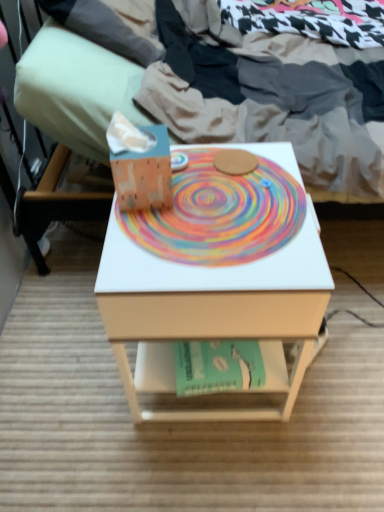
Where is `vacant point above teal paper at center (from a real-world perspective)`? This screenshot has height=512, width=384. vacant point above teal paper at center (from a real-world perspective) is located at coordinates (215, 352).